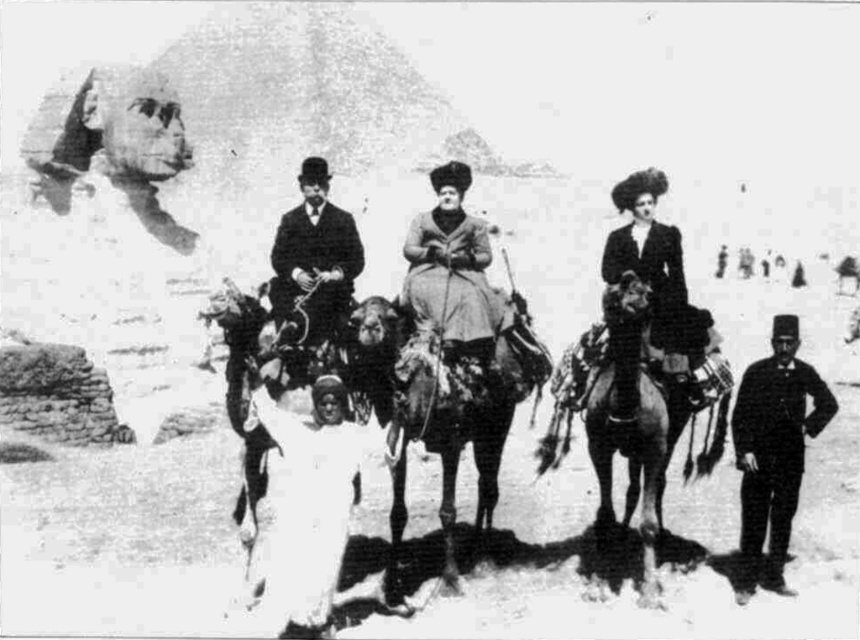
Question: Estimate the real-world distances between objects in this image. Which object is farther from the white matte horse at center?

Choices:
 (A) smooth brown horse at center
 (B) coarse woolen coat at center
 (C) dark brown suit at right

Answer: (C)

Question: Which point is farther to the camera?

Choices:
 (A) dark brown suit at right
 (B) white matte horse at center
 (C) coarse woolen coat at center
 (D) smooth black dress at center

Answer: (A)

Question: Does smooth black dress at center have a lesser width compared to smooth black suit at center?

Choices:
 (A) no
 (B) yes

Answer: (A)

Question: Where is smooth brown horse at center located in relation to smooth black dress at center in the image?

Choices:
 (A) left
 (B) right

Answer: (A)

Question: Does dark brown suit at right have a greater width compared to smooth black dress at center?

Choices:
 (A) yes
 (B) no

Answer: (B)

Question: Which point is closer to the camera?

Choices:
 (A) (668, 301)
 (B) (817, 426)

Answer: (A)